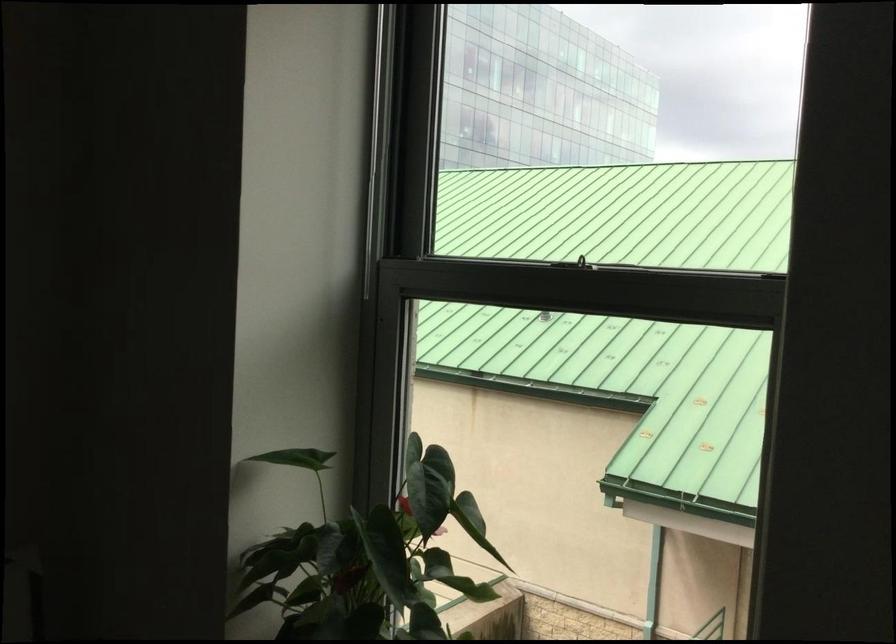
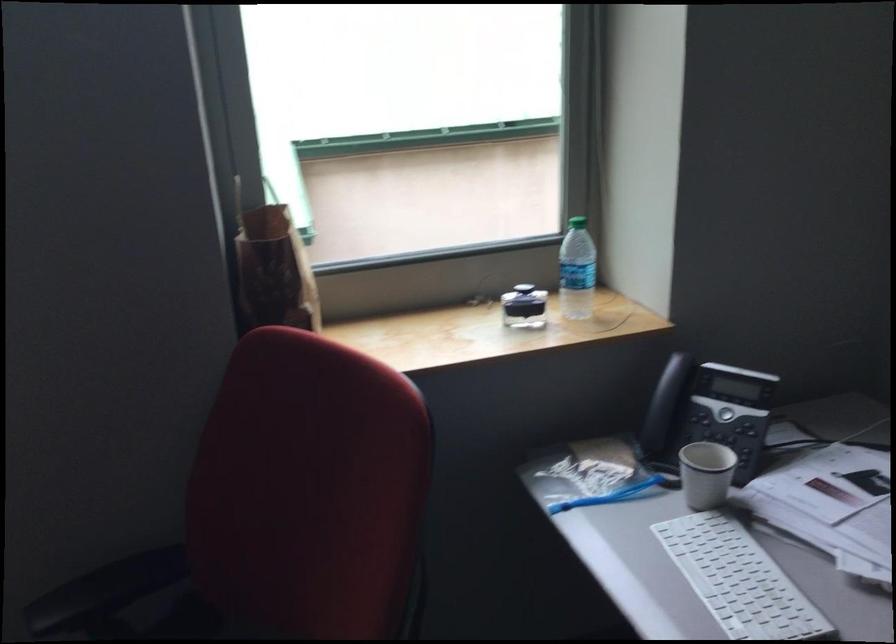
Based on the continuous images, in which direction is the camera rotating?

The camera rotated toward right-down.